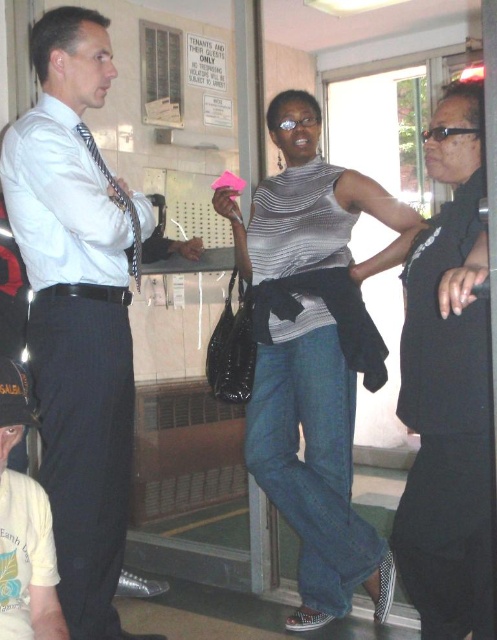
You are a security guard in the lobby and need to identify the tallest clothing item between the matte white shirt at center and the striped jersey at center. Which one is taller?

The matte white shirt at center is taller than the striped jersey at center.